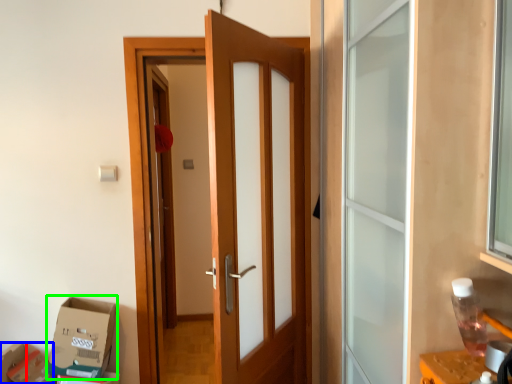
Question: Which object is the farthest from box (highlighted by a red box)? Choose among these: cardboard box (highlighted by a blue box) or cardboard box (highlighted by a green box).

Choices:
 (A) cardboard box
 (B) cardboard box

Answer: (B)